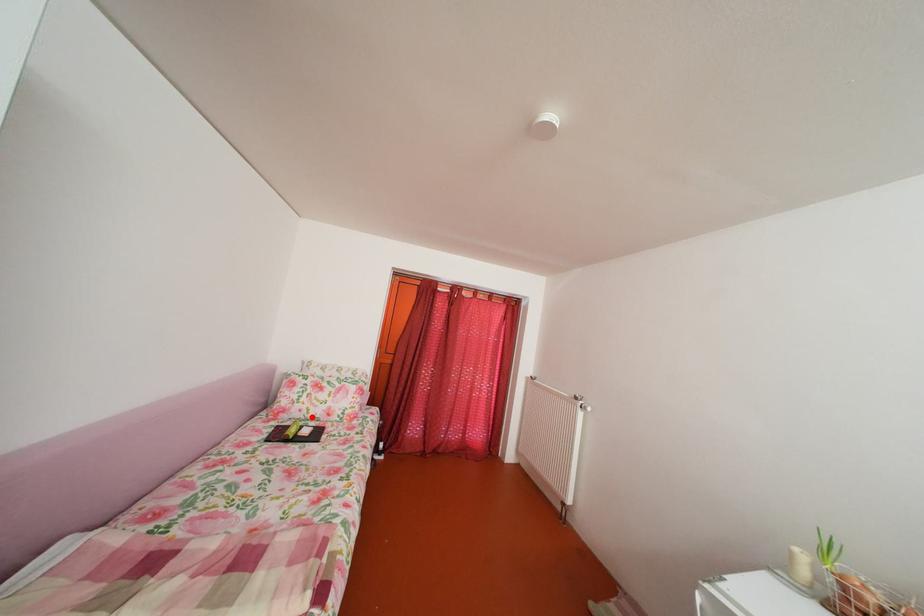
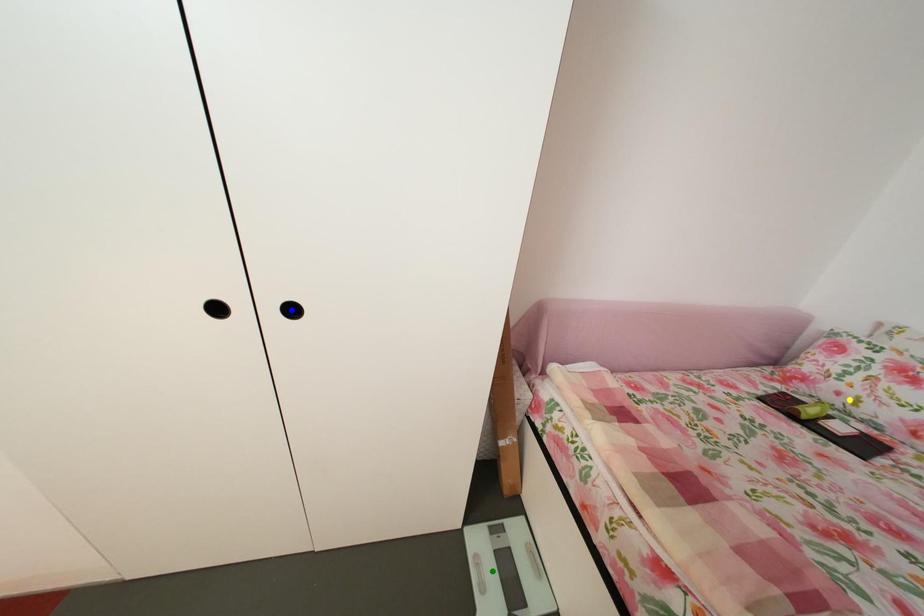
Question: I am providing you with two images of the same scene from different viewpoints. A red point is marked on the first image. You are given multiple points on the second image. Can you choose the point in image 2 that corresponds to the point in image 1?

Choices:
 (A) blue point
 (B) yellow point
 (C) green point

Answer: (B)